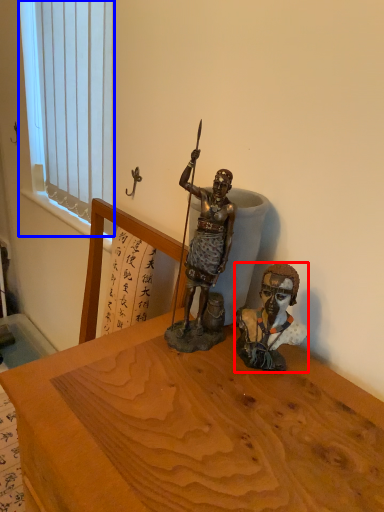
Question: Which point is closer to the camera, person (highlighted by a red box) or window (highlighted by a blue box)?

Choices:
 (A) person
 (B) window

Answer: (A)